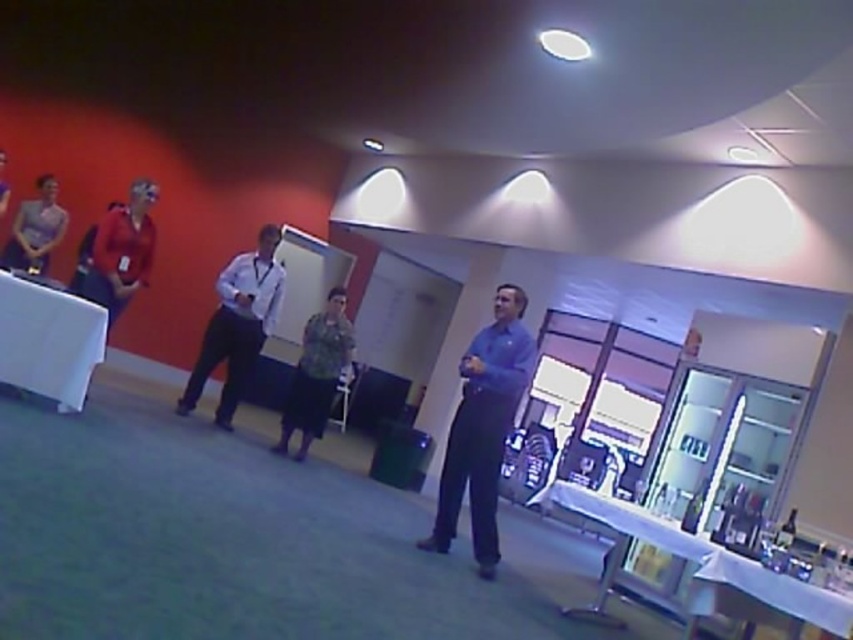
Between camouflage fabric shirt at center and matte purple dress at left, which one is positioned lower?

camouflage fabric shirt at center is below.

Does camouflage fabric shirt at center have a lesser width compared to matte purple dress at left?

Incorrect, camouflage fabric shirt at center's width is not less than matte purple dress at left's.

This screenshot has height=640, width=853. What are the coordinates of `camouflage fabric shirt at center` in the screenshot? It's located at (316, 372).

Image resolution: width=853 pixels, height=640 pixels. What do you see at coordinates (483, 428) in the screenshot?
I see `blue shirt at center` at bounding box center [483, 428].

Locate an element on the screen. blue shirt at center is located at coordinates (483, 428).

Locate an element on the screen. The height and width of the screenshot is (640, 853). white shirt at center is located at coordinates (236, 324).

Can you confirm if white shirt at center is positioned to the left of matte red shirt at left?

Incorrect, white shirt at center is not on the left side of matte red shirt at left.

Measure the distance between white shirt at center and camera.

white shirt at center and camera are 18.18 feet apart from each other.

You are a GUI agent. You are given a task and a screenshot of the screen. Output one action in this format:
    pyautogui.click(x=<x>, y=<y>)
    Task: Click on the white shirt at center
    
    Given the screenshot: What is the action you would take?
    pyautogui.click(x=236, y=324)